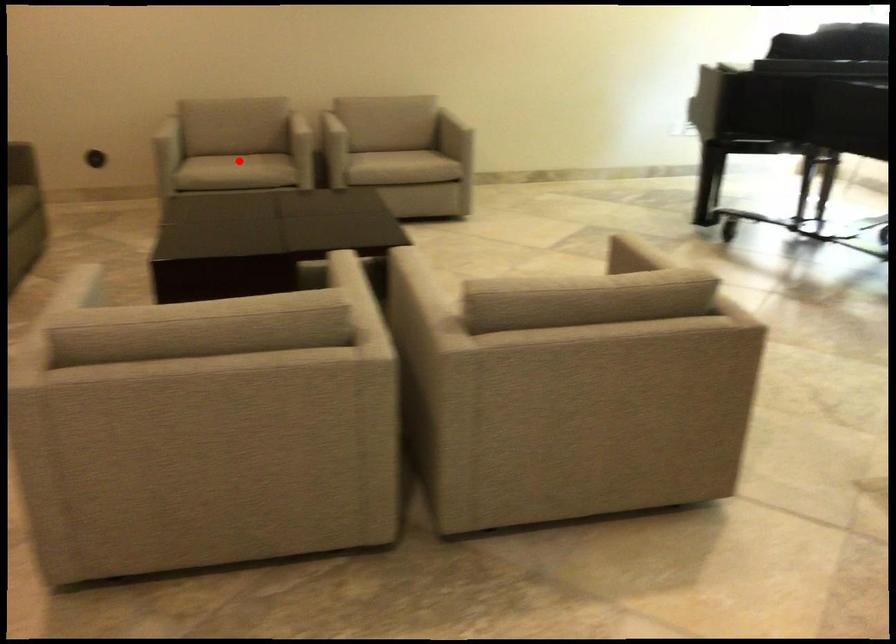
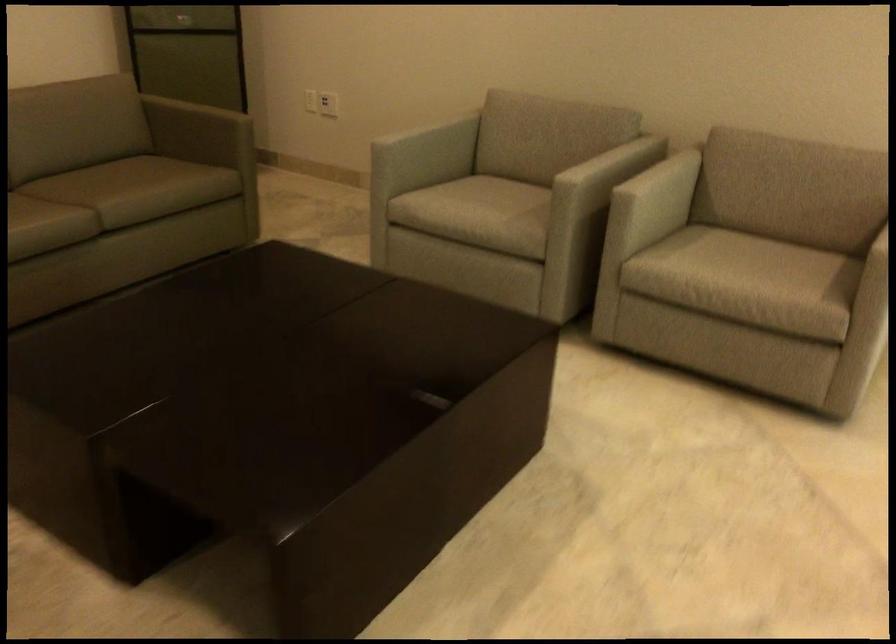
Question: A red point is marked in image1. In image2, is the corresponding 3D point closer to the camera or farther? Reply with the corresponding letter.

Choices:
 (A) The corresponding 3D point is closer.
 (B) The corresponding 3D point is farther.

Answer: (A)